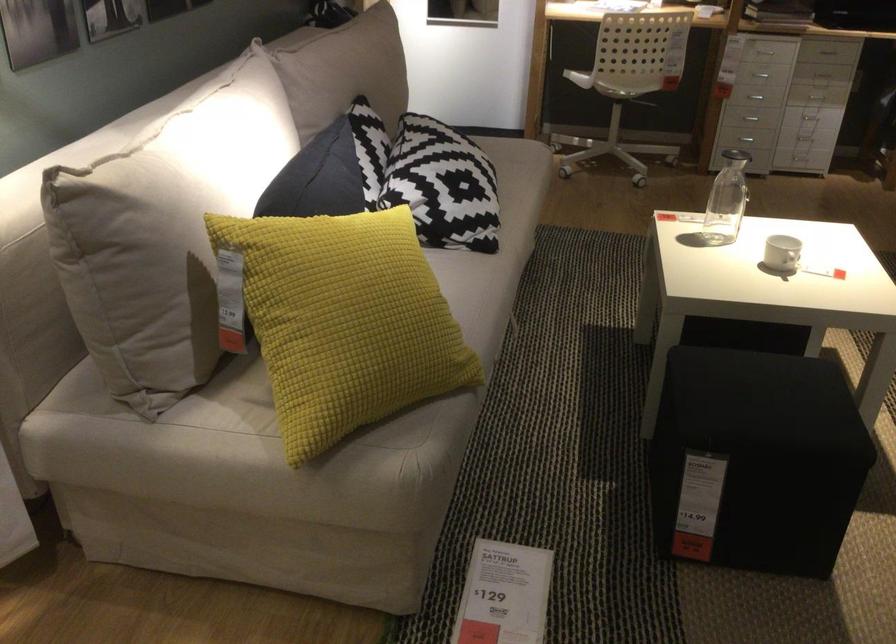
Where would you lift the glass carafe? Please return your answer as a coordinate pair (x, y).

(727, 200)